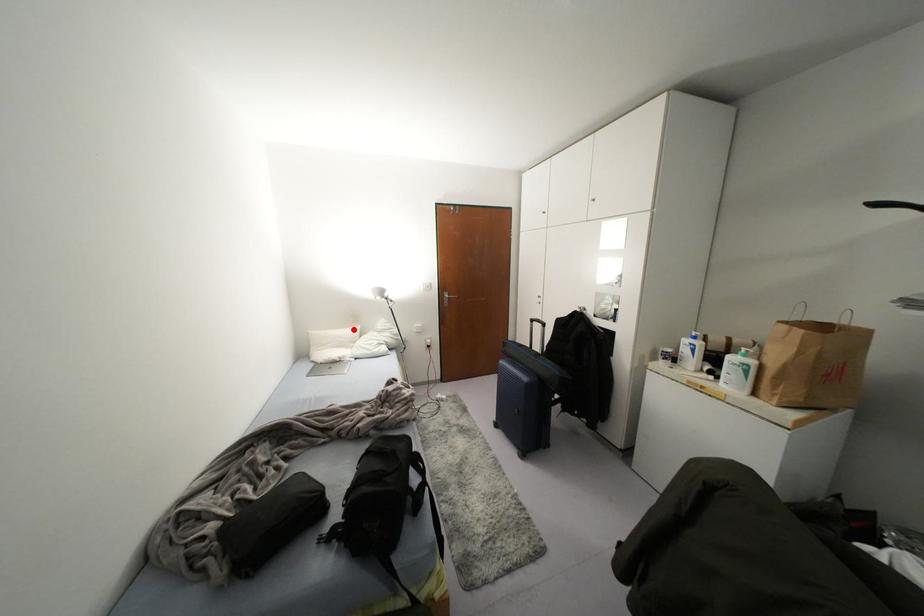
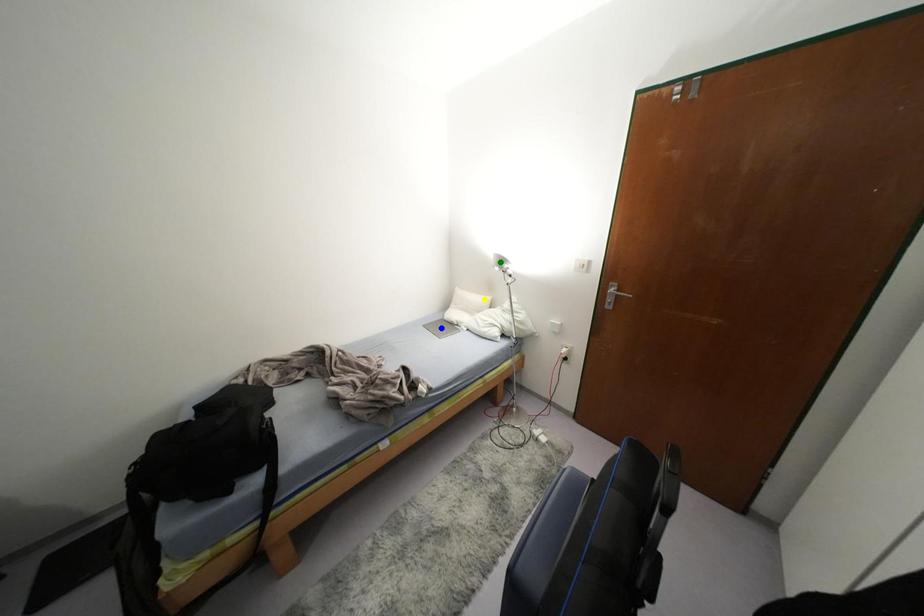
Question: I am providing you with two images of the same scene from different viewpoints. A red point is marked on the first image. You are given multiple points on the second image. Can you choose the point in image 2 that corresponds to the point in image 1?

Choices:
 (A) yellow point
 (B) blue point
 (C) green point

Answer: (A)